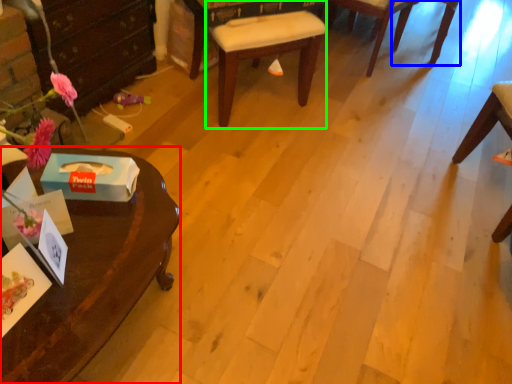
Question: Based on their relative distances, which object is farther from desk (highlighted by a red box)? Choose from chair (highlighted by a blue box) and chair (highlighted by a green box).

Choices:
 (A) chair
 (B) chair

Answer: (A)